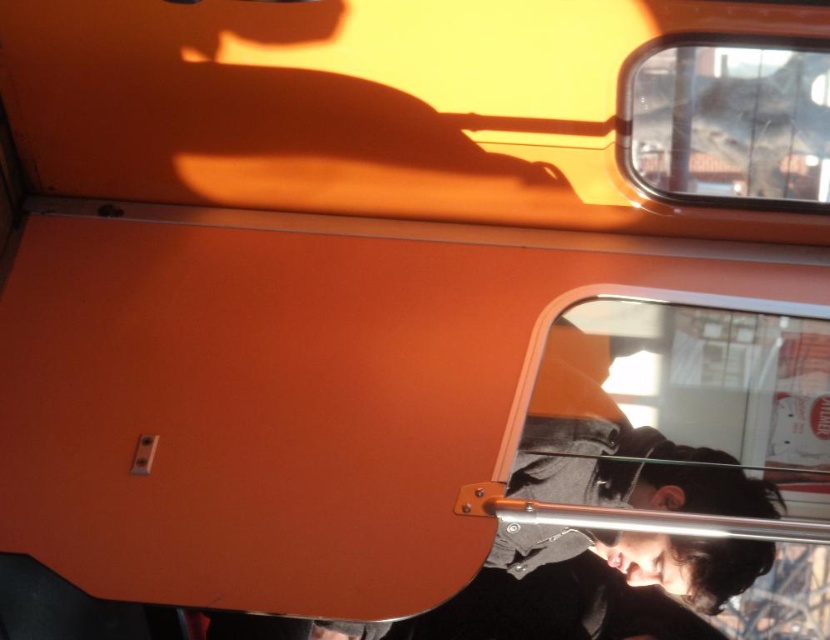
Which is more to the right, transparent glass window at lower right or transparent glass train window at upper right?

From the viewer's perspective, transparent glass train window at upper right appears more on the right side.

Is transparent glass window at lower right positioned at the back of transparent glass train window at upper right?

That is False.

Who is more forward, (x=574, y=509) or (x=813, y=77)?

Point (x=813, y=77) is in front.

Where is `transparent glass window at lower right`? transparent glass window at lower right is located at coordinates (670, 477).